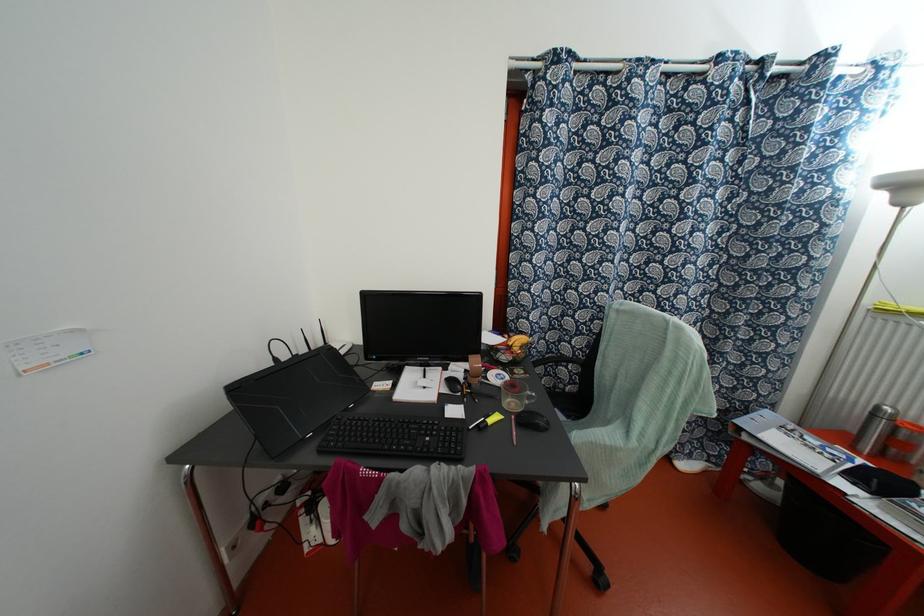
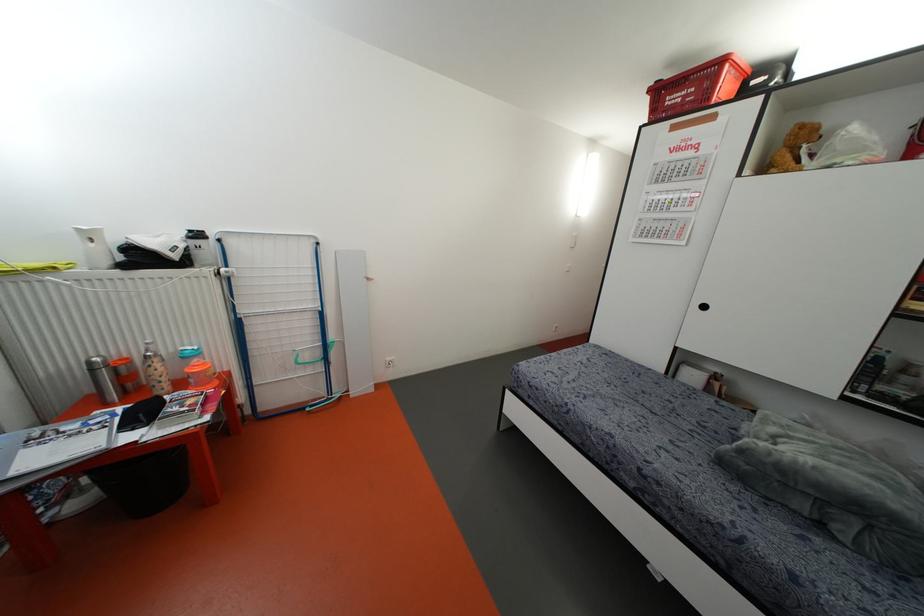
Locate, in the second image, the point that corresponds to the point at 872,415 in the first image.

(91, 370)